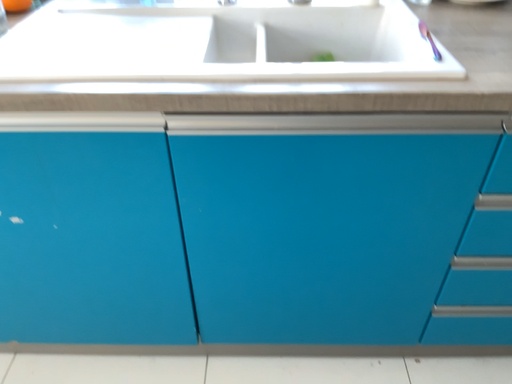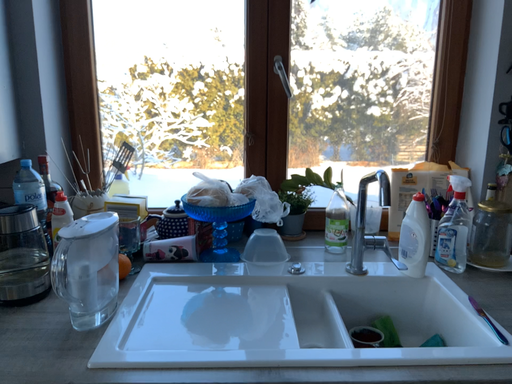
Question: How did the camera likely rotate when shooting the video?

Choices:
 (A) rotated downward
 (B) rotated upward

Answer: (B)